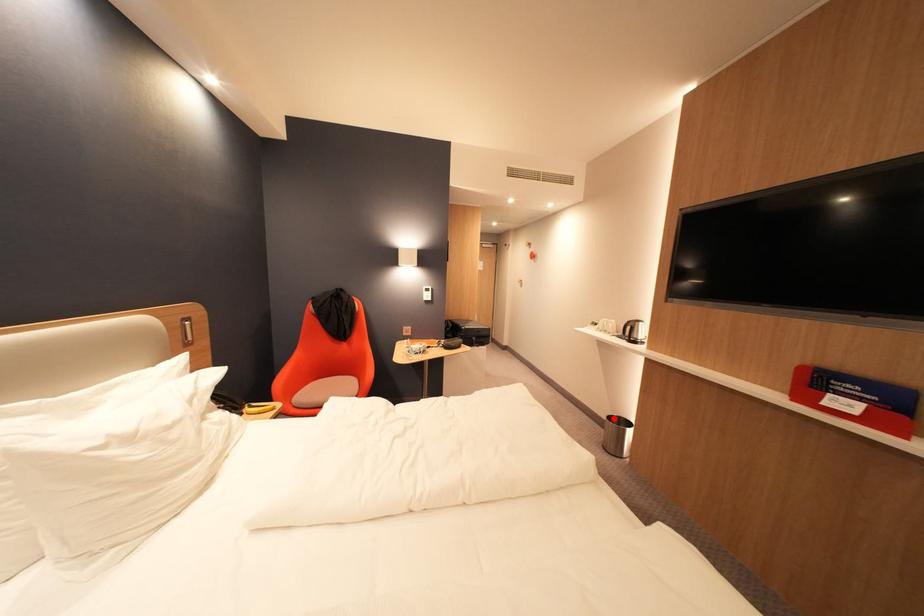
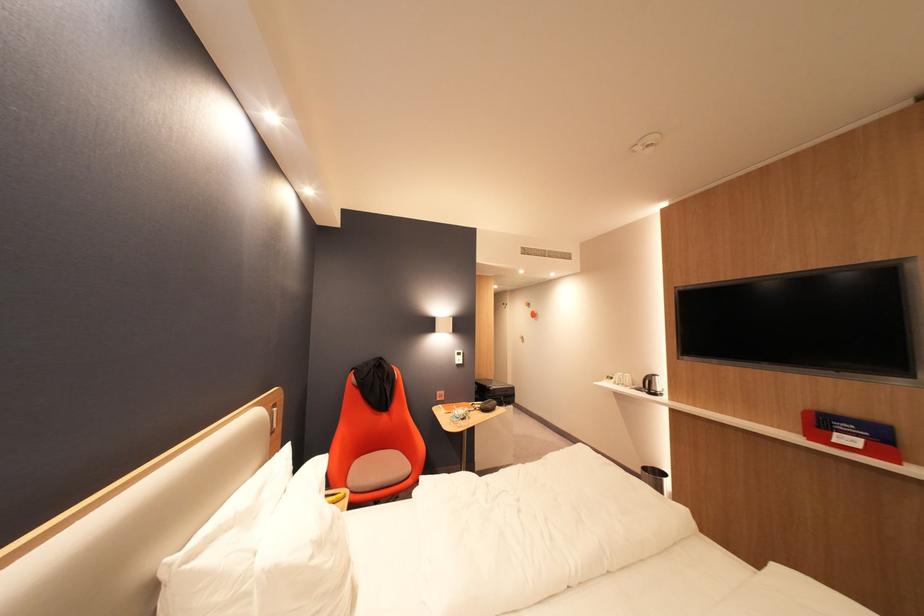
The point at the highlighted location is marked in the first image. Where is the corresponding point in the second image?

(648, 471)